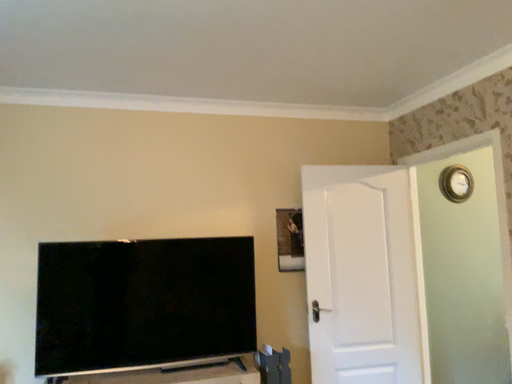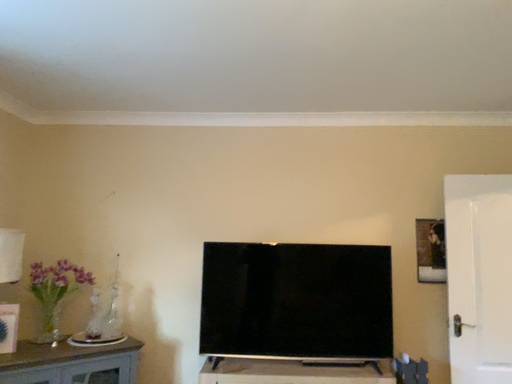
Question: How did the camera likely rotate when shooting the video?

Choices:
 (A) rotated right
 (B) rotated left

Answer: (B)